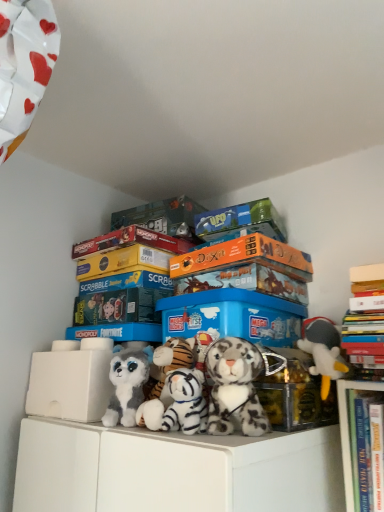
What is the approximate width of white plastic storage box at lower left, placed as the fourth storage box when sorted from right to left?

5.47 inches.

Measure the distance between gray plush toy at right, the fourth toy positioned from the left, and camera.

gray plush toy at right, the fourth toy positioned from the left, is 33.74 inches away from camera.

Image resolution: width=384 pixels, height=512 pixels. What do you see at coordinates (324, 352) in the screenshot?
I see `gray plush toy at right, which is the 1th toy from right to left` at bounding box center [324, 352].

Describe the element at coordinates (131, 242) in the screenshot. Image resolution: width=384 pixels, height=512 pixels. I see `matt orange board game at upper center, the 1th book when ordered from left to right` at that location.

The width and height of the screenshot is (384, 512). I want to click on white plush tiger at center, which is counted as the 3th toy, starting from the right, so (x=165, y=379).

Locate an element on the screen. This screenshot has height=512, width=384. fluffy white tiger at center, which is counted as the 2th toy, starting from the right is located at coordinates (235, 388).

Is white plush tiger at center, which is counted as the 3th toy, starting from the right, in front of fluffy white and gray plush toy at center, acting as the 4th toy starting from the right?

Yes, white plush tiger at center, which is counted as the 3th toy, starting from the right, is closer to the viewer.

How different are the orientations of white plush tiger at center, which is counted as the 3th toy, starting from the right, and fluffy white and gray plush toy at center, acting as the 4th toy starting from the right, in degrees?

The angular difference between white plush tiger at center, which is counted as the 3th toy, starting from the right, and fluffy white and gray plush toy at center, acting as the 4th toy starting from the right, is 24.7 degrees.

Between white plush tiger at center, positioned as the second toy in left-to-right order, and fluffy white and gray plush toy at center, acting as the 4th toy starting from the right, which one appears on the left side from the viewer's perspective?

fluffy white and gray plush toy at center, acting as the 4th toy starting from the right, is more to the left.

Are white plush tiger at center, which is counted as the 3th toy, starting from the right, and fluffy white and gray plush toy at center, acting as the 4th toy starting from the right, beside each other?

Yes, white plush tiger at center, which is counted as the 3th toy, starting from the right, is next to fluffy white and gray plush toy at center, acting as the 4th toy starting from the right.

Considering the sizes of objects metallic gold storage box at center, which is the 1th storage box from right to left, and gray plush toy at right, the fourth toy positioned from the left, in the image provided, who is shorter, metallic gold storage box at center, which is the 1th storage box from right to left, or gray plush toy at right, the fourth toy positioned from the left,?

Standing shorter between the two is metallic gold storage box at center, which is the 1th storage box from right to left.

Is metallic gold storage box at center, which is the 1th storage box from right to left, smaller than gray plush toy at right, which is the 1th toy from right to left?

Yes.

Which object is more forward, metallic gold storage box at center, which is counted as the fourth storage box, starting from the left, or gray plush toy at right, which is the 1th toy from right to left?

metallic gold storage box at center, which is counted as the fourth storage box, starting from the left, is closer to the camera.

Does point (383, 316) come in front of point (134, 423)?

No, (383, 316) is behind (134, 423).

Considering the positions of objects hardcover books at upper right, placed as the 1th book when sorted from right to left, and fluffy white and gray plush toy at center, which appears as the first toy when viewed from the left, in the image provided, who is in front, hardcover books at upper right, placed as the 1th book when sorted from right to left, or fluffy white and gray plush toy at center, which appears as the first toy when viewed from the left,?

hardcover books at upper right, placed as the 1th book when sorted from right to left, is more forward.

Based on the photo, do you think hardcover books at upper right, which is the 3th book in left-to-right order, is within fluffy white and gray plush toy at center, acting as the 4th toy starting from the right, or outside of it?

hardcover books at upper right, which is the 3th book in left-to-right order, exists outside the volume of fluffy white and gray plush toy at center, acting as the 4th toy starting from the right.

How far apart are blue plastic storage box at center, the 3th storage box from the right, and gray plush toy at right, the fourth toy positioned from the left?

6.52 inches.

Is blue plastic storage box at center, the 3th storage box from the right, bigger than gray plush toy at right, the fourth toy positioned from the left?

Indeed, blue plastic storage box at center, the 3th storage box from the right, has a larger size compared to gray plush toy at right, the fourth toy positioned from the left.

Locate an element on the screen. Image resolution: width=384 pixels, height=512 pixels. the 3rd storage box to the left when counting from the gray plush toy at right, the fourth toy positioned from the left is located at coordinates (232, 316).

Is blue plastic storage box at center, the 3th storage box from the right, to the right of gray plush toy at right, the fourth toy positioned from the left, from the viewer's perspective?

No, blue plastic storage box at center, the 3th storage box from the right, is not to the right of gray plush toy at right, the fourth toy positioned from the left.

From the image's perspective, which book is the 2nd one above the blue plastic storage box at center, placed as the third storage box when sorted from left to right? Please provide its 2D coordinates.

[(131, 242)]

Based on the photo, based on their sizes in the image, would you say matt orange board game at upper center, which is the third book in right-to-left order, is bigger or smaller than blue plastic storage box at center, which is counted as the second storage box, starting from the right?

matt orange board game at upper center, which is the third book in right-to-left order, is smaller than blue plastic storage box at center, which is counted as the second storage box, starting from the right.

How many degrees apart are the facing directions of matt orange board game at upper center, the 1th book when ordered from left to right, and blue plastic storage box at center, placed as the third storage box when sorted from left to right?

0.667 degrees.

Is matt orange board game at upper center, which is the third book in right-to-left order, to the left of blue plastic storage box at center, which is counted as the second storage box, starting from the right, from the viewer's perspective?

Yes.

Is orange matte board game at upper center, the second book positioned from the right, spatially inside white plastic storage box at lower left, positioned as the 1th storage box in left-to-right order, or outside of it?

orange matte board game at upper center, the second book positioned from the right, is not inside white plastic storage box at lower left, positioned as the 1th storage box in left-to-right order, it's outside.

Consider the image. Is orange matte board game at upper center, the second book positioned from the right, not near white plastic storage box at lower left, placed as the fourth storage box when sorted from right to left?

No, there isn't a large distance between orange matte board game at upper center, the second book positioned from the right, and white plastic storage box at lower left, placed as the fourth storage box when sorted from right to left.

Who is taller, orange matte board game at upper center, the second book positioned from the right, or white plastic storage box at lower left, positioned as the 1th storage box in left-to-right order?

white plastic storage box at lower left, positioned as the 1th storage box in left-to-right order.

Visually, is metallic gold storage box at center, which is counted as the fourth storage box, starting from the left, positioned to the left or to the right of matt orange board game at upper center, the 1th book when ordered from left to right?

metallic gold storage box at center, which is counted as the fourth storage box, starting from the left, is to the right of matt orange board game at upper center, the 1th book when ordered from left to right.

How many degrees apart are the facing directions of metallic gold storage box at center, which is the 1th storage box from right to left, and matt orange board game at upper center, the 1th book when ordered from left to right?

They differ by 91.8 degrees in their facing directions.

Does point (294, 423) appear closer or farther from the camera than point (103, 250)?

Clearly, point (294, 423) is closer to the camera than point (103, 250).

Which of these two, metallic gold storage box at center, which is counted as the fourth storage box, starting from the left, or matt orange board game at upper center, the 1th book when ordered from left to right, is wider?

matt orange board game at upper center, the 1th book when ordered from left to right.

The height and width of the screenshot is (512, 384). Identify the location of the 1st toy above the white plush tiger at center, which is counted as the 3th toy, starting from the right (from a real-world perspective). (127, 385).

Locate an element on the screen. the 1st toy behind the metallic gold storage box at center, which is the 1th storage box from right to left is located at coordinates (324, 352).

Looking at the image, which one is located further to fluffy white and gray plush toy at center, acting as the 4th toy starting from the right, hardcover books at upper right, which is the 3th book in left-to-right order, or hardcover books at upper right?

The object further to fluffy white and gray plush toy at center, acting as the 4th toy starting from the right, is hardcover books at upper right, which is the 3th book in left-to-right order.

From the image, which object appears to be nearer to blue plastic storage box at center, the second storage box positioned from the left, fluffy white tiger at center, the third toy when ordered from left to right, or metallic gold storage box at center, which is the 1th storage box from right to left?

The object closer to blue plastic storage box at center, the second storage box positioned from the left, is metallic gold storage box at center, which is the 1th storage box from right to left.

Estimate the real-world distances between objects in this image. Which object is further from blue plastic storage box at center, which is counted as the second storage box, starting from the right, hardcover books at upper right, placed as the 1th book when sorted from right to left, or fluffy white and gray plush toy at center, acting as the 4th toy starting from the right?

Based on the image, fluffy white and gray plush toy at center, acting as the 4th toy starting from the right, appears to be further to blue plastic storage box at center, which is counted as the second storage box, starting from the right.

Looking at the image, which one is located closer to orange matte board game at upper center, the second book positioned from the right, fluffy white and gray plush toy at center, acting as the 4th toy starting from the right, or blue plastic storage box at center, the second storage box positioned from the left?

blue plastic storage box at center, the second storage box positioned from the left.

When comparing their distances from white plastic storage box at lower left, positioned as the 1th storage box in left-to-right order, does matt orange board game at upper center, the 1th book when ordered from left to right, or orange matte board game at upper center, the second book positioned from the right, seem closer?

matt orange board game at upper center, the 1th book when ordered from left to right, lies closer to white plastic storage box at lower left, positioned as the 1th storage box in left-to-right order, than the other object.

Estimate the real-world distances between objects in this image. Which object is closer to white plush tiger at center, which is counted as the 3th toy, starting from the right, fluffy white and gray plush toy at center, which appears as the first toy when viewed from the left, or hardcover books at upper right?

Based on the image, fluffy white and gray plush toy at center, which appears as the first toy when viewed from the left, appears to be nearer to white plush tiger at center, which is counted as the 3th toy, starting from the right.

When comparing their distances from blue plastic storage box at center, the second storage box positioned from the left, does orange matte board game at upper center, which is the 2th book from left to right, or matt orange board game at upper center, the 1th book when ordered from left to right, seem further?

The object further to blue plastic storage box at center, the second storage box positioned from the left, is matt orange board game at upper center, the 1th book when ordered from left to right.

Based on their spatial positions, is blue plastic storage box at center, the second storage box positioned from the left, or fluffy white tiger at center, which is counted as the 2th toy, starting from the right, closer to fluffy white and gray plush toy at center, which appears as the first toy when viewed from the left?

fluffy white tiger at center, which is counted as the 2th toy, starting from the right, lies closer to fluffy white and gray plush toy at center, which appears as the first toy when viewed from the left, than the other object.

Find the location of a particular element. Image resolution: width=384 pixels, height=512 pixels. bookcase between hardcover books at upper right, which is the 3th book in left-to-right order, and blue plastic storage box at center, placed as the third storage box when sorted from left to right, in the front-back direction is located at coordinates (349, 430).

Identify the location of toy between white plush tiger at center, positioned as the second toy in left-to-right order, and gray plush toy at right, the fourth toy positioned from the left. The image size is (384, 512). (235, 388).

This screenshot has width=384, height=512. In order to click on storage box between orange matte board game at upper center, the second book positioned from the right, and blue plastic storage box at center, the 3th storage box from the right, from top to bottom in this screenshot , I will do `click(246, 282)`.

This screenshot has width=384, height=512. What are the coordinates of `book situated between fluffy white and gray plush toy at center, acting as the 4th toy starting from the right, and metallic gold storage box at center, which is the 1th storage box from right to left, from left to right` in the screenshot? It's located at (244, 257).